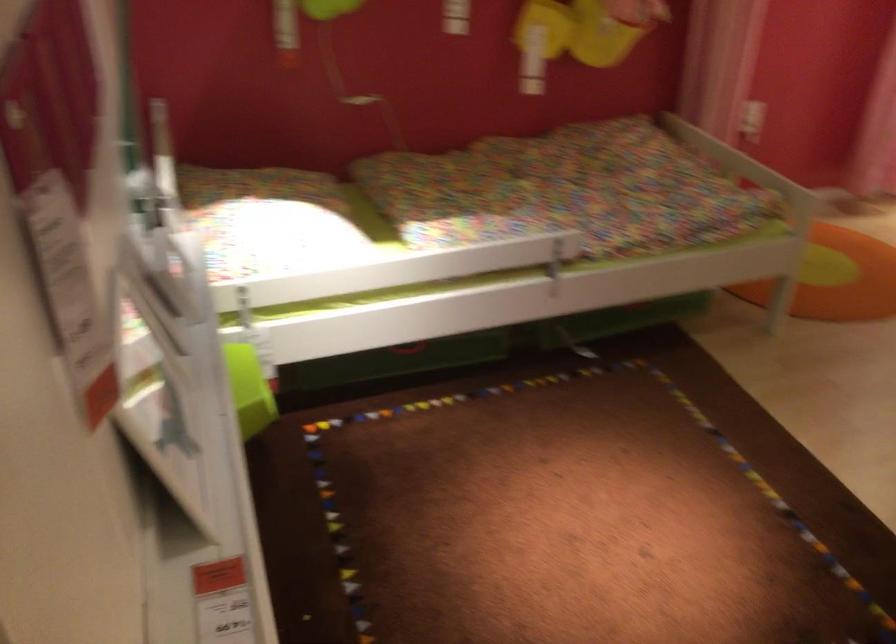
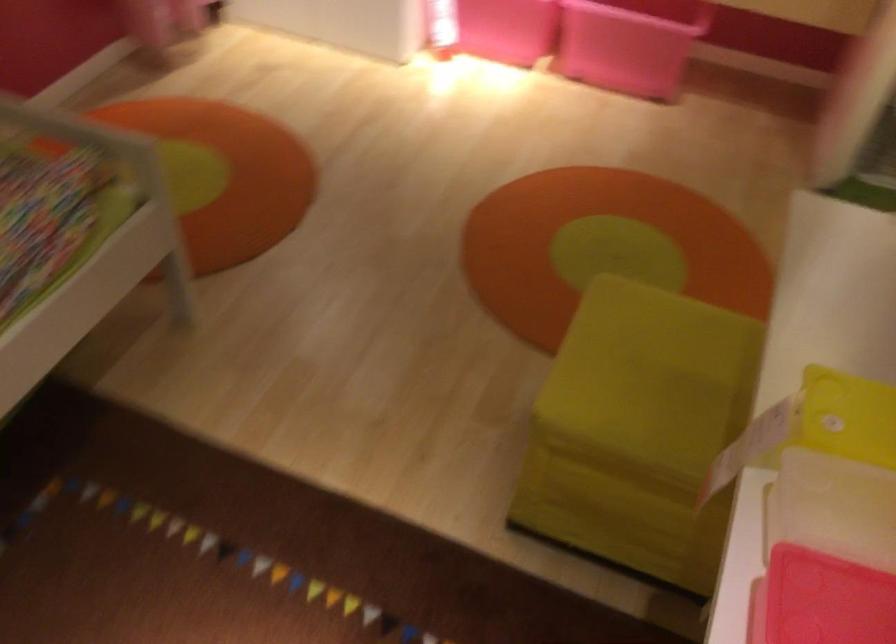
The images are taken continuously from a first-person perspective. In which direction is your viewpoint rotating?

The camera rotated toward right-down.